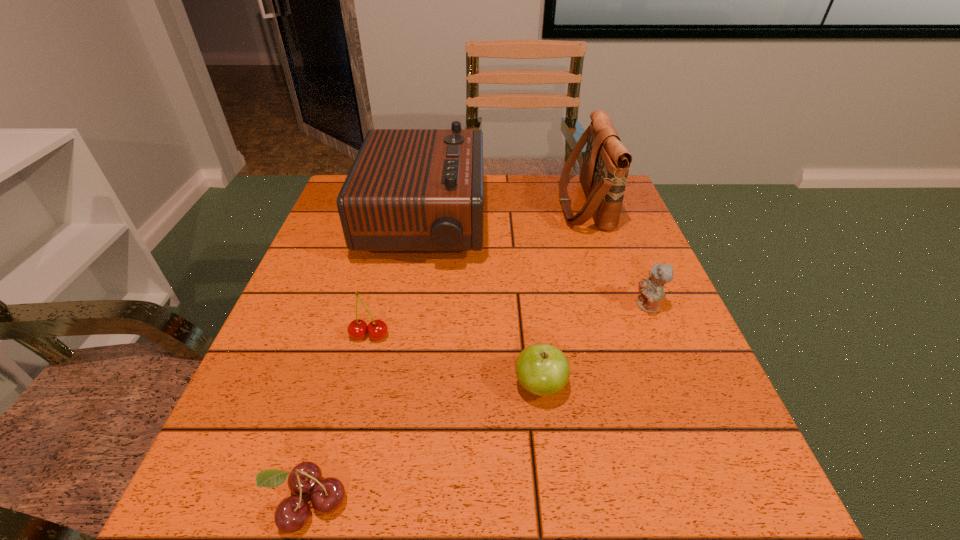
In order to click on shoulder bag that is at the right edge in this screenshot , I will do `click(606, 163)`.

Identify the location of teddy bear that is at the right edge. This screenshot has height=540, width=960. (651, 290).

Find the location of `object present at the far left corner`. object present at the far left corner is located at coordinates [x=408, y=190].

This screenshot has height=540, width=960. Find the location of `object that is at the near left corner`. object that is at the near left corner is located at coordinates (327, 495).

This screenshot has height=540, width=960. I want to click on object present at the far right corner, so click(606, 163).

The image size is (960, 540). Find the location of `vacant space at the far edge`. vacant space at the far edge is located at coordinates (532, 202).

Locate an element on the screen. The width and height of the screenshot is (960, 540). free location at the left edge of the desktop is located at coordinates (316, 349).

I want to click on blank area at the right edge, so click(606, 342).

Find the location of a particular element. Image resolution: width=960 pixels, height=540 pixels. free region at the near right corner of the desktop is located at coordinates (672, 497).

Locate an element on the screen. Image resolution: width=960 pixels, height=540 pixels. vacant space that is in between the teddy bear and the shoulder bag is located at coordinates (616, 255).